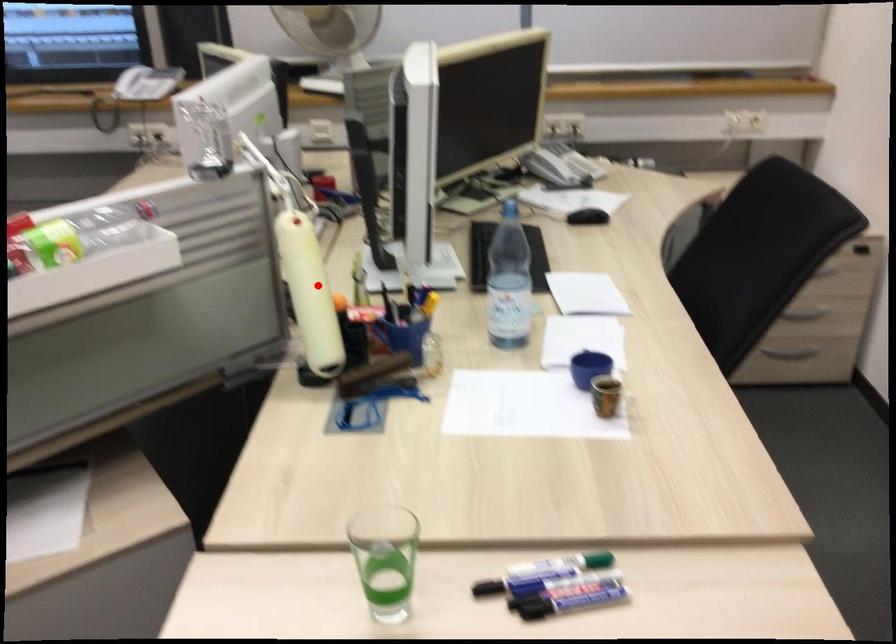
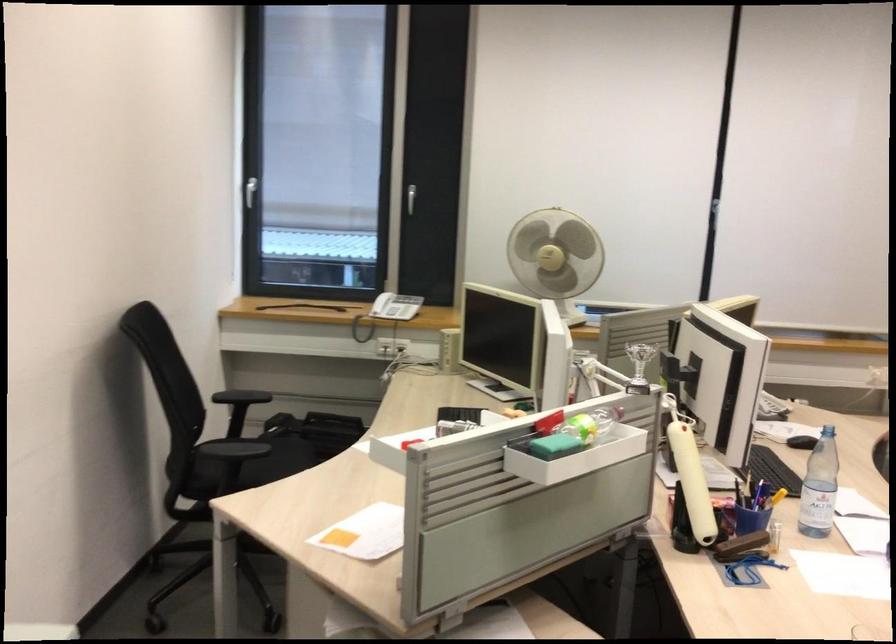
Where in the second image is the point corresponding to the highlighted location from the first image?

(690, 475)